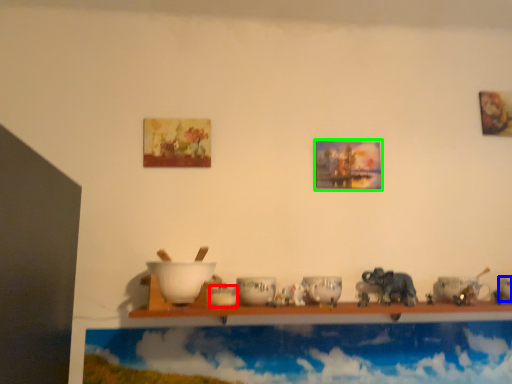
Question: Which is nearer to the tableware (highlighted by a red box)? tableware (highlighted by a blue box) or picture frame (highlighted by a green box).

Choices:
 (A) tableware
 (B) picture frame

Answer: (B)